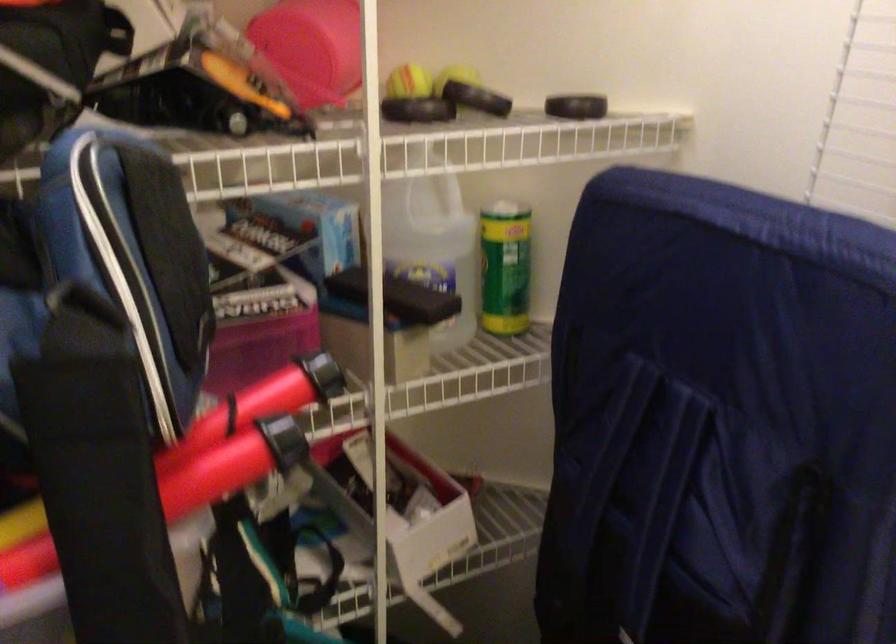
Image resolution: width=896 pixels, height=644 pixels. What do you see at coordinates (282, 440) in the screenshot?
I see `the black plastic buckle` at bounding box center [282, 440].